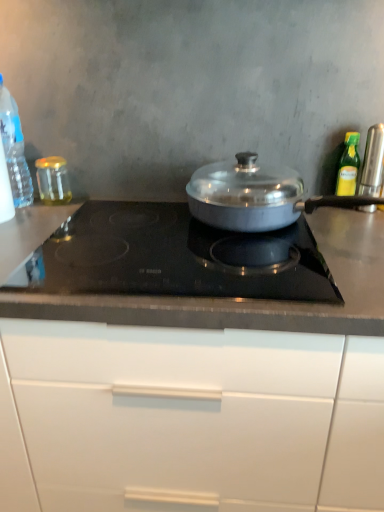
Identify the location of vacant area that is in front of satin silver pan at center, the 3th kitchen appliance when ordered from right to left. (276, 285).